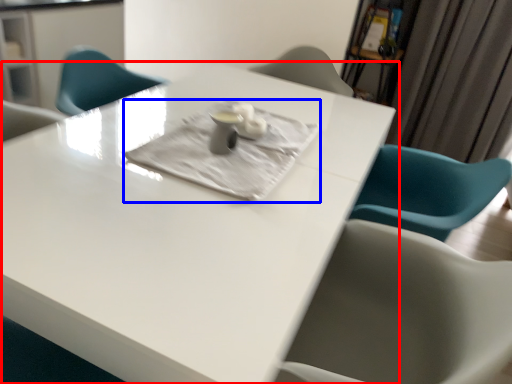
Question: Which object appears closest to the camera in this image, table (highlighted by a red box) or cloth (highlighted by a blue box)?

Choices:
 (A) table
 (B) cloth

Answer: (A)